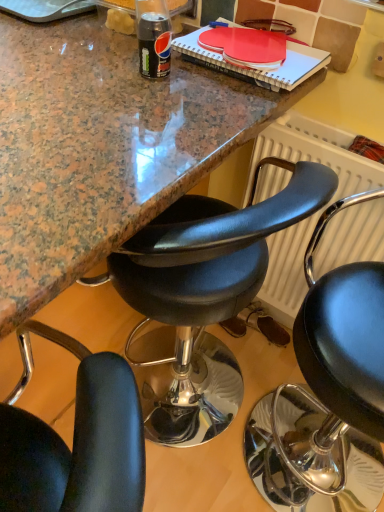
Question: In the image, is black leather chair at center, the 1th chair viewed from the right, positioned in front of or behind white textured radiator at right?

Choices:
 (A) behind
 (B) front

Answer: (B)

Question: From a real-world perspective, is black leather chair at center, which is the second chair from left to right, above or below white textured radiator at right?

Choices:
 (A) below
 (B) above

Answer: (A)

Question: Which is farther from the black leather chair at center, which is the second chair from left to right?

Choices:
 (A) black leather chair at center, positioned as the second chair in right-to-left order
 (B) white textured radiator at right

Answer: (A)

Question: Which is nearer to the black leather chair at center, positioned as the second chair in right-to-left order?

Choices:
 (A) black leather chair at center, the 1th chair viewed from the right
 (B) white textured radiator at right

Answer: (B)